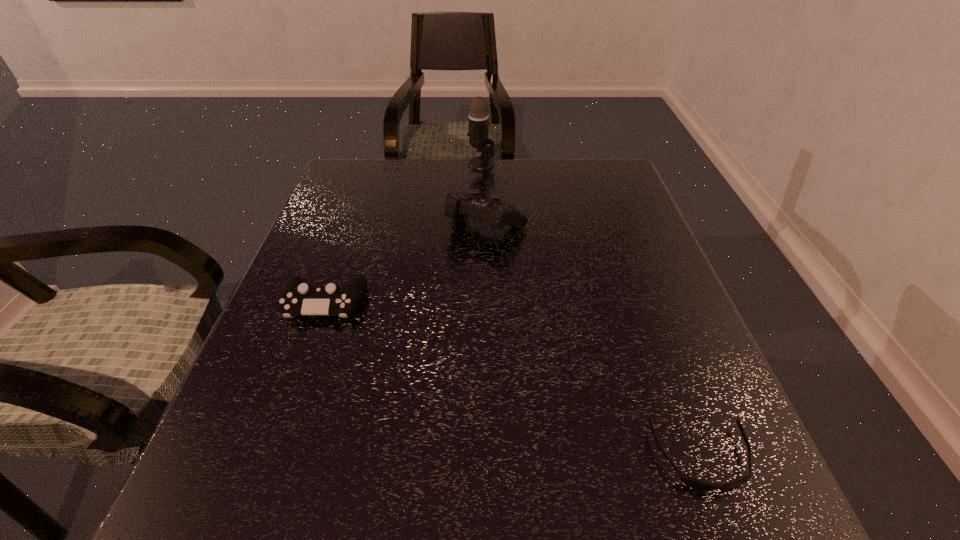
The height and width of the screenshot is (540, 960). I want to click on vacant space at the far right corner of the desktop, so click(591, 198).

The image size is (960, 540). In order to click on vacant region at the near right corner of the desktop in this screenshot , I will do `click(680, 514)`.

You are a GUI agent. You are given a task and a screenshot of the screen. Output one action in this format:
    pyautogui.click(x=<x>, y=<y>)
    Task: Click on the unoccupied position between the shortest object and the taller control
    This screenshot has height=540, width=960.
    Given the screenshot: What is the action you would take?
    pyautogui.click(x=594, y=342)

This screenshot has width=960, height=540. Identify the location of free space between the microphone and the shortest object. (591, 311).

Find the location of a particular element. vacant space that's between the sunglasses and the second farthest object is located at coordinates (594, 342).

I want to click on free space that is in between the second nearest object and the nearest object, so click(514, 381).

Identify the location of free spot between the farthest object and the sunglasses. click(x=591, y=311).

Locate an element on the screen. free space between the right control and the rightmost object is located at coordinates (594, 342).

Locate an element on the screen. This screenshot has height=540, width=960. empty location between the taller control and the nearer control is located at coordinates (406, 265).

Find the location of a particular element. This screenshot has width=960, height=540. blank region between the tallest object and the third nearest object is located at coordinates (484, 195).